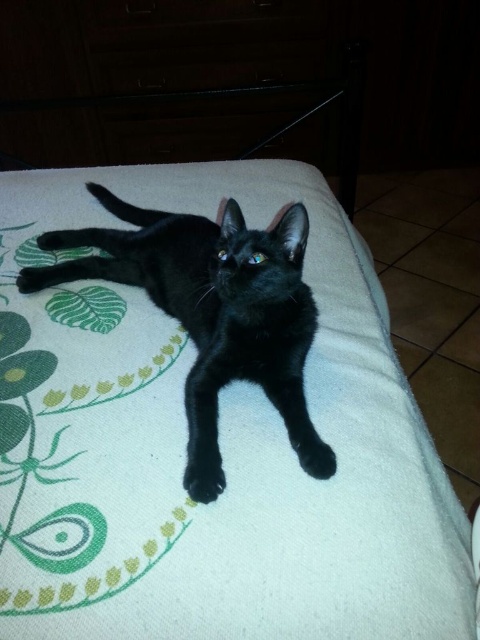
Who is positioned more to the left, white soft blanket at center or black matte cat at center?

black matte cat at center

Does white soft blanket at center have a greater height compared to black matte cat at center?

Yes, white soft blanket at center is taller than black matte cat at center.

Locate an element on the screen. This screenshot has height=640, width=480. white soft blanket at center is located at coordinates (219, 444).

I want to click on white soft blanket at center, so click(x=219, y=444).